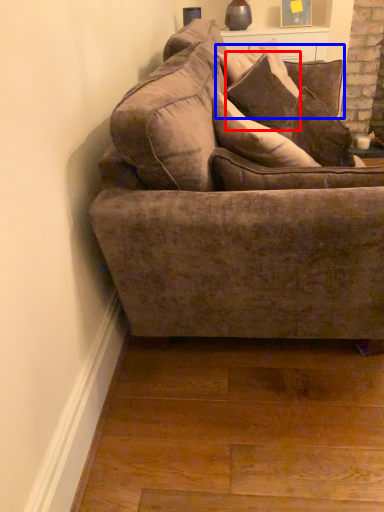
Question: Which object appears farthest to the camera in this image, pillow (highlighted by a red box) or pillow (highlighted by a blue box)?

Choices:
 (A) pillow
 (B) pillow

Answer: (B)